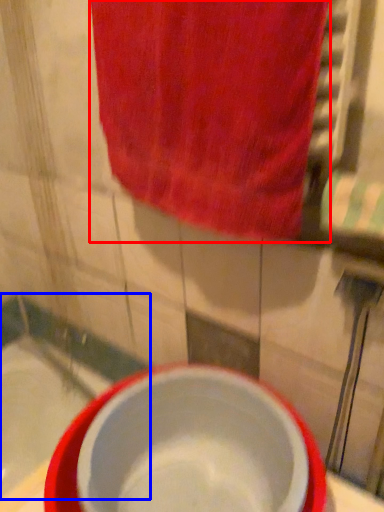
Question: Which object is closer to the camera taking this photo, towel (highlighted by a red box) or bath (highlighted by a blue box)?

Choices:
 (A) towel
 (B) bath

Answer: (A)